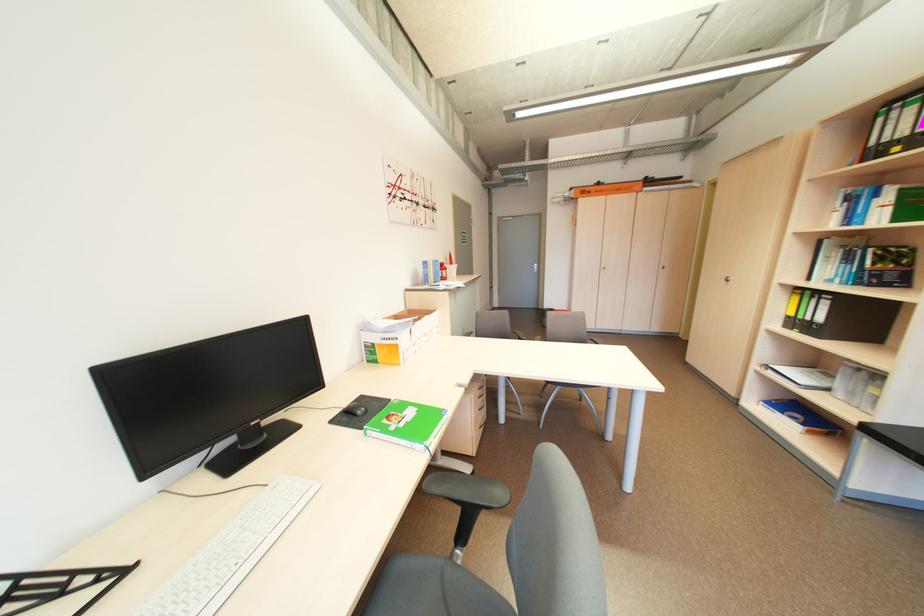
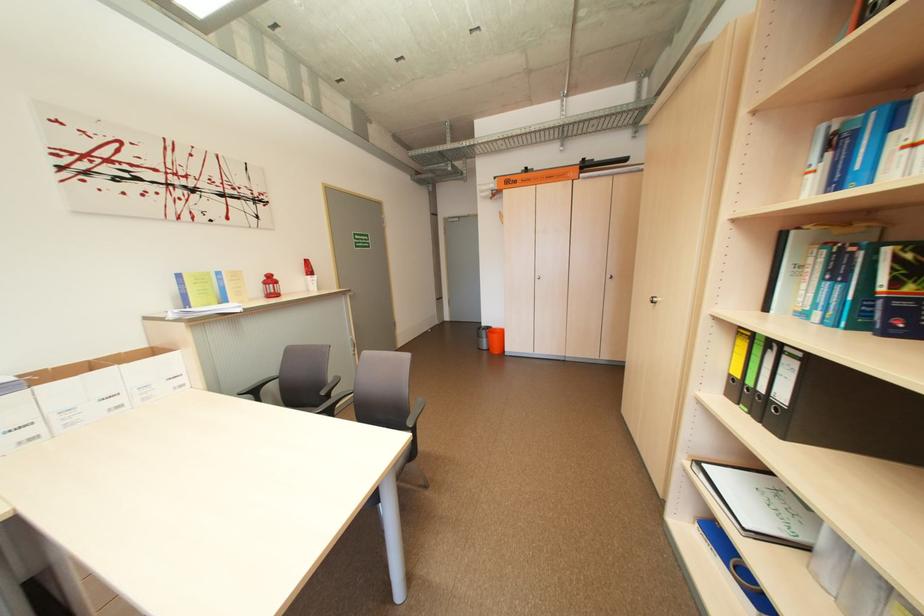
Find the pixel in the second image that matches pixel 830 321 in the first image.

(792, 399)